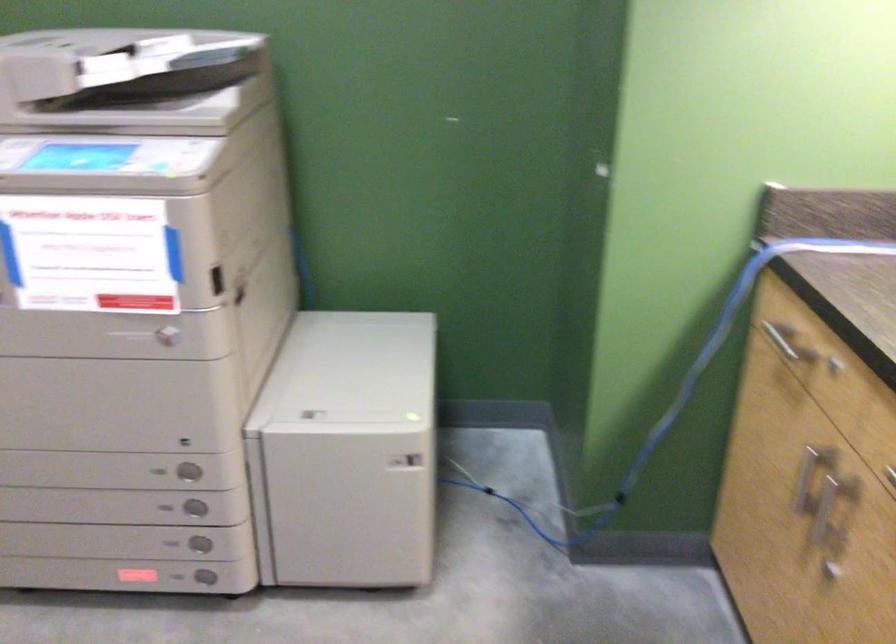
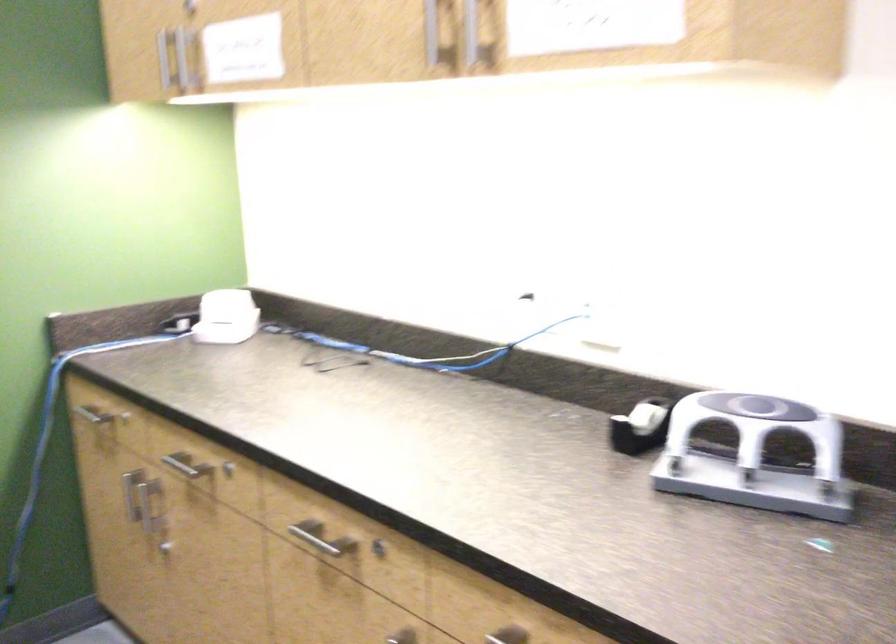
Find the pixel in the second image that matches the point at 746,333 in the first image.

(92, 413)